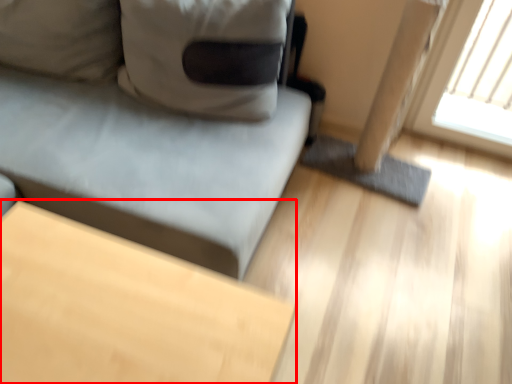
Question: From the image's perspective, what is the correct spatial relationship of table (annotated by the red box) in relation to studio couch?

Choices:
 (A) above
 (B) below

Answer: (B)